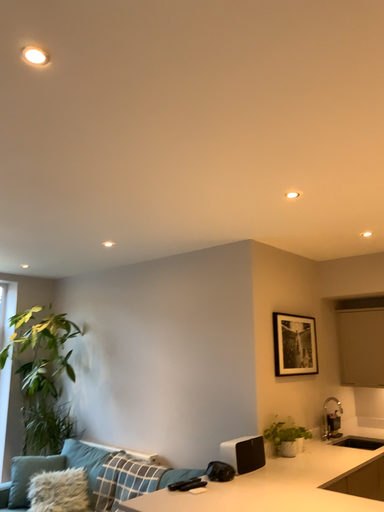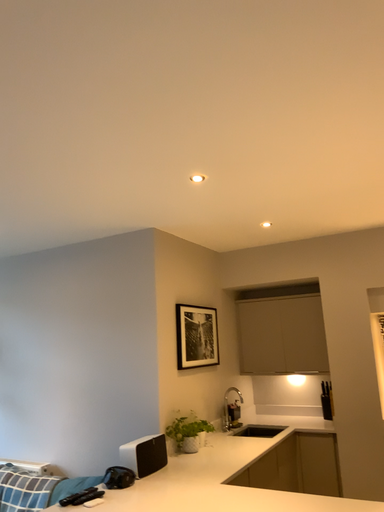
Question: Which way did the camera rotate in the video?

Choices:
 (A) rotated right
 (B) rotated left

Answer: (A)